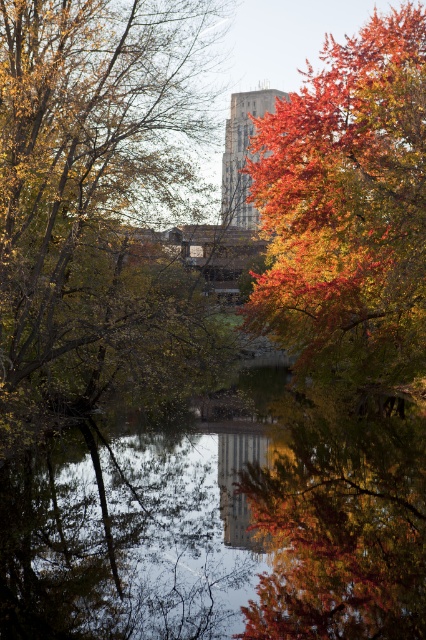
Question: Among these points, which one is nearest to the camera?

Choices:
 (A) (17, 109)
 (B) (232, 221)

Answer: (A)

Question: Which object is closer to the camera taking this photo?

Choices:
 (A) smooth concrete tower at center
 (B) autumn leaves at center
 (C) transparent glass water at center

Answer: (C)

Question: Can you confirm if transparent glass water at center is thinner than autumn leaves at center?

Choices:
 (A) yes
 (B) no

Answer: (B)

Question: Can you confirm if autumn leaves at center is bigger than smooth concrete tower at center?

Choices:
 (A) no
 (B) yes

Answer: (A)

Question: Does transparent glass water at center have a larger size compared to shiny red leaves at upper right?

Choices:
 (A) yes
 (B) no

Answer: (B)

Question: Which object is positioned farthest from the autumn leaves at center?

Choices:
 (A) shiny red leaves at upper right
 (B) transparent glass water at center
 (C) smooth concrete tower at center

Answer: (C)